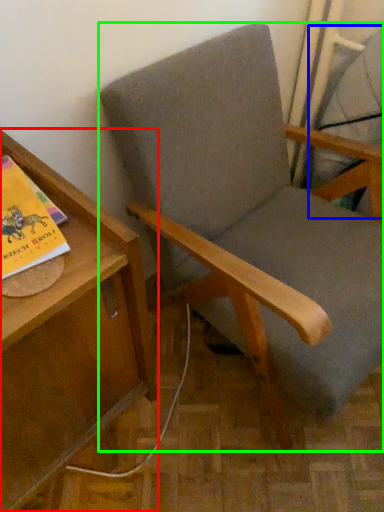
Question: Which object is the farthest from table (highlighted by a red box)? Choose among these: swivel chair (highlighted by a blue box) or chair (highlighted by a green box).

Choices:
 (A) swivel chair
 (B) chair

Answer: (A)